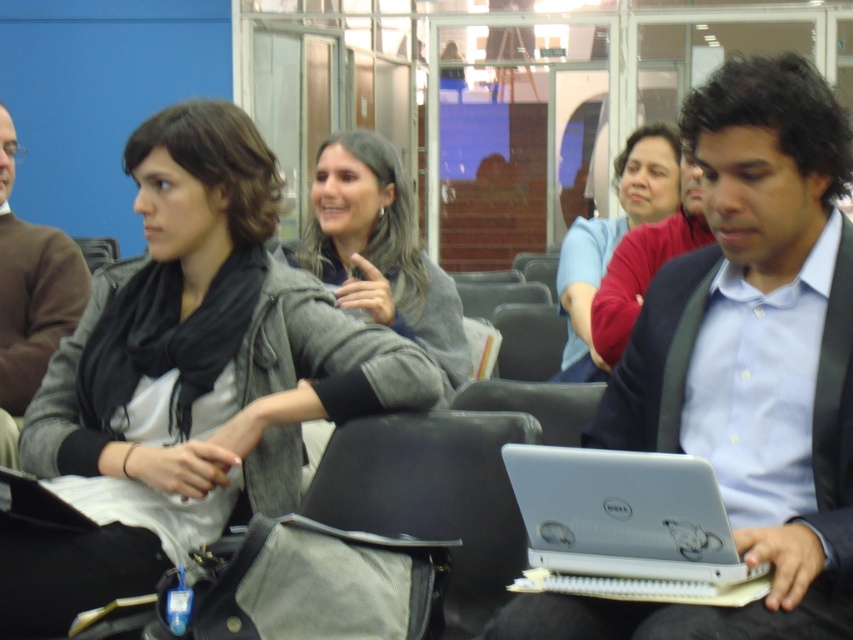
Question: Can you confirm if matte silver laptop at center is positioned to the right of brown sweater at left?

Choices:
 (A) yes
 (B) no

Answer: (A)

Question: Considering the real-world distances, which object is closest to the brown sweater at left?

Choices:
 (A) matte silver laptop at center
 (B) matte red sweater at center
 (C) white matte laptop at lower right
 (D) gray woolen sweater at center

Answer: (D)

Question: Can you confirm if matte silver laptop at center is positioned above white matte laptop at lower right?

Choices:
 (A) yes
 (B) no

Answer: (A)

Question: From the image, what is the correct spatial relationship of matte silver laptop at center in relation to matte red sweater at center?

Choices:
 (A) right
 (B) left

Answer: (A)

Question: Which object is positioned closest to the white matte laptop at lower right?

Choices:
 (A) gray woolen sweater at center
 (B) brown sweater at left
 (C) matte silver laptop at center
 (D) matte red sweater at center

Answer: (C)

Question: Which of the following is the farthest from the observer?

Choices:
 (A) white matte laptop at lower right
 (B) gray woolen scarf at upper left

Answer: (B)